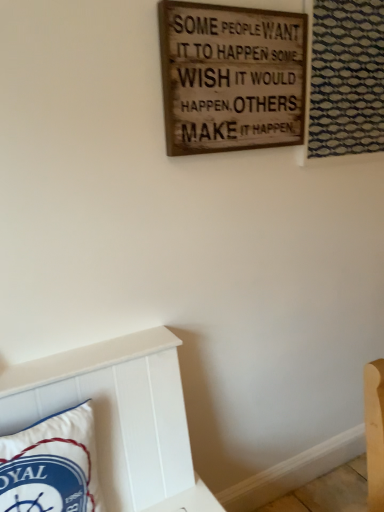
Question: From the image's perspective, would you say wooden signboard at upper center is positioned over blue textured fabric at upper right?

Choices:
 (A) yes
 (B) no

Answer: (B)

Question: Does wooden signboard at upper center come behind blue textured fabric at upper right?

Choices:
 (A) no
 (B) yes

Answer: (A)

Question: Is wooden signboard at upper center wider than blue textured fabric at upper right?

Choices:
 (A) no
 (B) yes

Answer: (A)

Question: Considering the relative sizes of wooden signboard at upper center and blue textured fabric at upper right in the image provided, is wooden signboard at upper center bigger than blue textured fabric at upper right?

Choices:
 (A) no
 (B) yes

Answer: (A)

Question: From a real-world perspective, does wooden signboard at upper center sit lower than blue textured fabric at upper right?

Choices:
 (A) yes
 (B) no

Answer: (A)

Question: Is blue textured fabric at upper right surrounded by wooden signboard at upper center?

Choices:
 (A) no
 (B) yes

Answer: (A)

Question: Does white fabric pillow at lower left contain wooden signboard at upper center?

Choices:
 (A) no
 (B) yes

Answer: (A)

Question: Is white fabric pillow at lower left beside wooden signboard at upper center?

Choices:
 (A) yes
 (B) no

Answer: (B)

Question: Is white fabric pillow at lower left to the left of wooden signboard at upper center from the viewer's perspective?

Choices:
 (A) no
 (B) yes

Answer: (B)

Question: Considering the relative positions of white fabric pillow at lower left and wooden signboard at upper center in the image provided, is white fabric pillow at lower left to the right of wooden signboard at upper center from the viewer's perspective?

Choices:
 (A) yes
 (B) no

Answer: (B)

Question: Is white fabric pillow at lower left located outside wooden signboard at upper center?

Choices:
 (A) yes
 (B) no

Answer: (A)

Question: Is white fabric pillow at lower left facing away from wooden signboard at upper center?

Choices:
 (A) no
 (B) yes

Answer: (A)

Question: From the image's perspective, is blue textured fabric at upper right below wooden signboard at upper center?

Choices:
 (A) no
 (B) yes

Answer: (A)